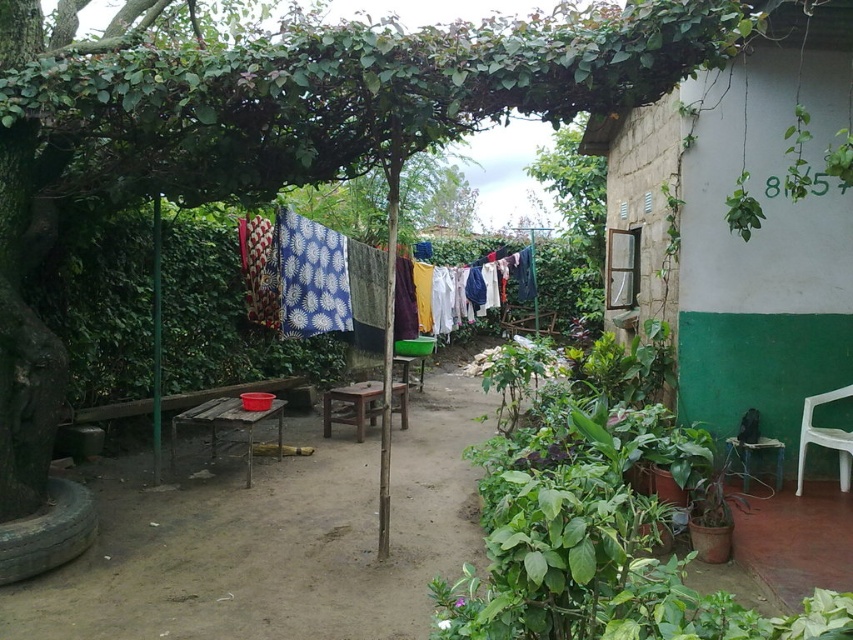
You are standing at the entrance of the garden and want to place a new potted plant exactly at the center of the garden. The garden is a rectangular area with coordinates from point A at the bottom left corner to point B at the top right corner. The coordinates of the center would be the average of the coordinates of the corners. However, there is already a dull wood table at center located at point 0.842, 0.322. Can you determine if the center of the garden is the same as the location of the dull wood dull

The center of the garden would be the average of the coordinates of the corners. However, the dull wood table at center is already positioned at point [274,538], so it is located exactly at the center of the garden.

You are standing in the garden and want to walk from the dull wood table at center to the green concrete wall at right. Which direction should you move in?

You should move towards the green concrete wall at right, which is behind the dull wood table at center since the table is closer to you than the wall.

Consider the image. You are standing at the point with coordinates point (660, 256) and want to walk towards the point with coordinates point (343, 305). Which direction should you move?

You should move towards the point (343, 305) by walking forward since point (660, 256) is in front of point (343, 305).